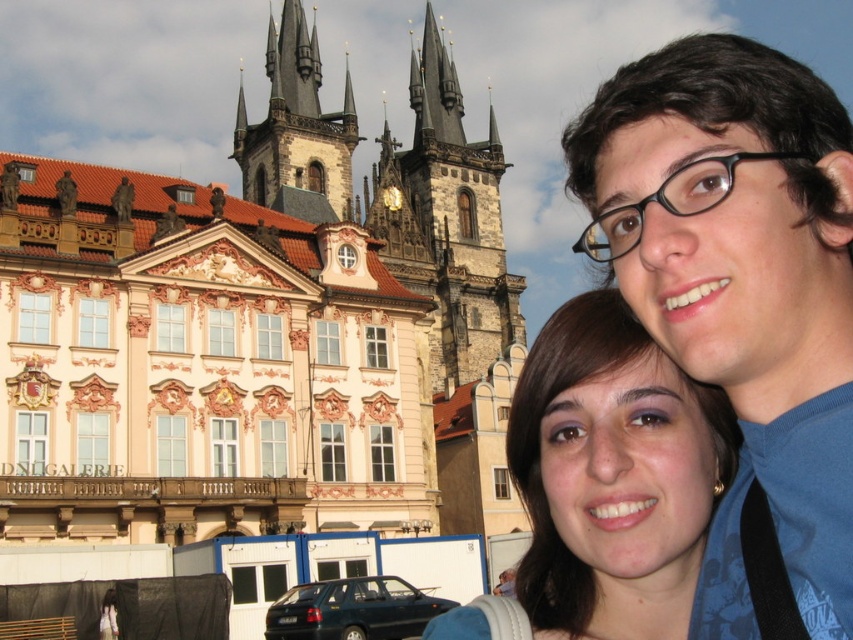
Question: Can you confirm if dark gray stone church at upper center is wider than brown hair at center?

Choices:
 (A) yes
 (B) no

Answer: (A)

Question: Estimate the real-world distances between objects in this image. Which object is farther from the dark gray stone tower at center?

Choices:
 (A) dark gray stone church at upper center
 (B) blue fabric at center

Answer: (B)

Question: Is dark gray stone tower at center thinner than dark brown stone tower at center?

Choices:
 (A) no
 (B) yes

Answer: (B)

Question: Among these points, which one is nearest to the camera?

Choices:
 (A) (509, 342)
 (B) (572, 456)
 (C) (663, 122)
 (D) (268, 118)

Answer: (C)

Question: Does dark gray stone tower at center lie in front of dark brown stone tower at center?

Choices:
 (A) yes
 (B) no

Answer: (B)

Question: Which object appears closest to the camera in this image?

Choices:
 (A) dark brown stone tower at center
 (B) brown hair at center
 (C) dark gray stone tower at center
 (D) dark gray stone church at upper center

Answer: (B)